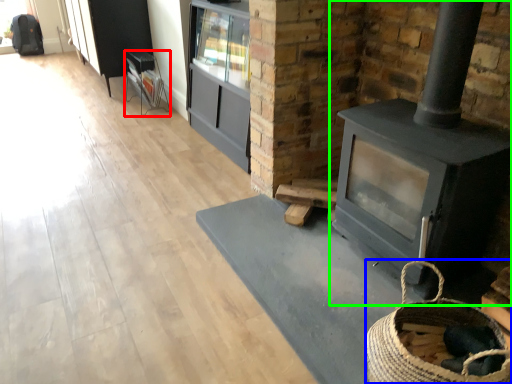
Question: Considering the real-world distances, which object is closest to furniture (highlighted by a red box)? basket (highlighted by a blue box) or wood burning stove (highlighted by a green box).

Choices:
 (A) basket
 (B) wood burning stove

Answer: (B)